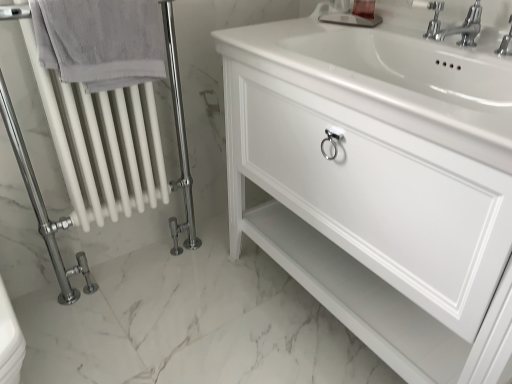
Measure the distance between point (x=446, y=28) and camera.

A distance of 1.15 meters exists between point (x=446, y=28) and camera.

Identify the location of white glossy cabinet at center. This screenshot has width=512, height=384. (381, 182).

Is point (93, 206) farther from viewer compared to point (447, 81)?

Yes, point (93, 206) is behind point (447, 81).

Choose the correct answer: Is white glossy radiator at left inside white glossy cabinet at center or outside it?

white glossy radiator at left is not inside white glossy cabinet at center, it's outside.

Locate an element on the screen. radiator behind the white glossy cabinet at center is located at coordinates (103, 144).

From the image's perspective, would you say gray cotton towel at left is shown under chrome metallic faucet at upper right?

Yes, from the image's perspective, gray cotton towel at left is beneath chrome metallic faucet at upper right.

Where is `bath towel on the left of chrome metallic faucet at upper right`? The width and height of the screenshot is (512, 384). bath towel on the left of chrome metallic faucet at upper right is located at coordinates (100, 41).

Considering the relative sizes of gray cotton towel at left and chrome metallic faucet at upper right in the image provided, is gray cotton towel at left wider than chrome metallic faucet at upper right?

In fact, gray cotton towel at left might be narrower than chrome metallic faucet at upper right.

Who is bigger, clear plastic soap at upper center or chrome metallic faucet at upper right?

With larger size is chrome metallic faucet at upper right.

This screenshot has height=384, width=512. In order to click on tap lying on the right of clear plastic soap at upper center in this screenshot , I will do `click(455, 26)`.

Is clear plastic soap at upper center not near chrome metallic faucet at upper right?

No, there isn't a large distance between clear plastic soap at upper center and chrome metallic faucet at upper right.

Does chrome metallic faucet at upper right have a greater width compared to gray cotton towel at left?

Correct, the width of chrome metallic faucet at upper right exceeds that of gray cotton towel at left.

From the image's perspective, between chrome metallic faucet at upper right and gray cotton towel at left, which one is located above?

chrome metallic faucet at upper right, from the image's perspective.

Locate an element on the screen. Image resolution: width=512 pixels, height=384 pixels. bath towel below the chrome metallic faucet at upper right (from the image's perspective) is located at coordinates (100, 41).

The width and height of the screenshot is (512, 384). I want to click on toiletry that is above the white glossy radiator at left (from the image's perspective), so tap(364, 9).

Could you tell me if clear plastic soap at upper center is facing white glossy radiator at left?

No, clear plastic soap at upper center is not facing towards white glossy radiator at left.

Are clear plastic soap at upper center and white glossy radiator at left located far from each other?

No, there isn't a large distance between clear plastic soap at upper center and white glossy radiator at left.

Does clear plastic soap at upper center appear on the right side of white glossy radiator at left?

Yes.

Are polished chrome faucet at upper right and chrome metallic faucet at upper right beside each other?

Yes, polished chrome faucet at upper right is touching chrome metallic faucet at upper right.

Does polished chrome faucet at upper right have a lesser width compared to chrome metallic faucet at upper right?

Yes, polished chrome faucet at upper right is thinner than chrome metallic faucet at upper right.

From a real-world perspective, is polished chrome faucet at upper right under chrome metallic faucet at upper right?

Yes, from a real-world perspective, polished chrome faucet at upper right is beneath chrome metallic faucet at upper right.

Considering the positions of point (437, 21) and point (436, 27), is point (437, 21) closer or farther from the camera than point (436, 27)?

Point (437, 21) is farther from the camera than point (436, 27).

Which is in front, point (368, 12) or point (394, 256)?

Point (394, 256)

From a real-world perspective, which object rests below the other?

white glossy cabinet at center is physically lower.

Looking at their sizes, would you say clear plastic soap at upper center is wider or thinner than white glossy cabinet at center?

clear plastic soap at upper center is thinner than white glossy cabinet at center.

Where is `toiletry behind the white glossy cabinet at center`? toiletry behind the white glossy cabinet at center is located at coordinates (364, 9).

Where is `bathroom cabinet located underneath the white glossy radiator at left (from a real-world perspective)`? The width and height of the screenshot is (512, 384). bathroom cabinet located underneath the white glossy radiator at left (from a real-world perspective) is located at coordinates (381, 182).

This screenshot has width=512, height=384. Identify the location of bath towel that appears below the chrome metallic faucet at upper right (from the image's perspective). (100, 41).

Which object lies further to the anchor point white glossy cabinet at center, chrome metallic faucet at upper right or polished chrome faucet at upper right?

polished chrome faucet at upper right is further to white glossy cabinet at center.

Based on their spatial positions, is clear plastic soap at upper center or gray cotton towel at left closer to white glossy radiator at left?

gray cotton towel at left.

When comparing their distances from white glossy cabinet at center, does gray cotton towel at left or chrome metallic faucet at upper right seem closer?

chrome metallic faucet at upper right lies closer to white glossy cabinet at center than the other object.

From the picture: From the image, which object appears to be farther from clear plastic soap at upper center, white glossy cabinet at center or polished chrome faucet at upper right?

white glossy cabinet at center lies further to clear plastic soap at upper center than the other object.

Looking at the image, which one is located closer to polished chrome faucet at upper right, gray cotton towel at left or chrome metallic faucet at upper right?

Based on the image, chrome metallic faucet at upper right appears to be nearer to polished chrome faucet at upper right.

Estimate the real-world distances between objects in this image. Which object is further from white glossy cabinet at center, chrome metallic faucet at upper right or white glossy radiator at left?

Based on the image, white glossy radiator at left appears to be further to white glossy cabinet at center.

Consider the image. Considering their positions, is white glossy radiator at left positioned further to polished chrome faucet at upper right than gray cotton towel at left?

Based on the image, white glossy radiator at left appears to be further to polished chrome faucet at upper right.

Considering their positions, is chrome metallic faucet at upper right positioned closer to polished chrome faucet at upper right than white glossy cabinet at center?

Based on the image, chrome metallic faucet at upper right appears to be nearer to polished chrome faucet at upper right.

This screenshot has height=384, width=512. I want to click on bathroom cabinet located between white glossy radiator at left and chrome metallic faucet at upper right in the left-right direction, so click(381, 182).

Identify the location of bathroom cabinet located between white glossy radiator at left and polished chrome faucet at upper right in the left-right direction. (381, 182).

Identify the location of toiletry between gray cotton towel at left and white glossy cabinet at center in the horizontal direction. (364, 9).

This screenshot has width=512, height=384. What are the coordinates of `bath towel between white glossy radiator at left and clear plastic soap at upper center in the horizontal direction` in the screenshot? It's located at (100, 41).